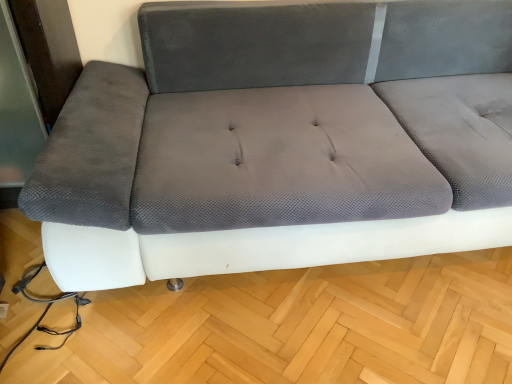
What is the approximate height of dark gray fabric couch at center?

dark gray fabric couch at center is 74.90 centimeters tall.

This screenshot has height=384, width=512. What do you see at coordinates (281, 142) in the screenshot?
I see `dark gray fabric couch at center` at bounding box center [281, 142].

Where is `dark gray fabric couch at center`? The height and width of the screenshot is (384, 512). dark gray fabric couch at center is located at coordinates (281, 142).

Locate an element on the screen. The width and height of the screenshot is (512, 384). dark gray fabric couch at center is located at coordinates (281, 142).